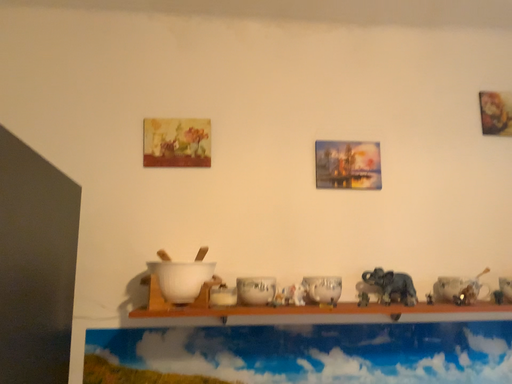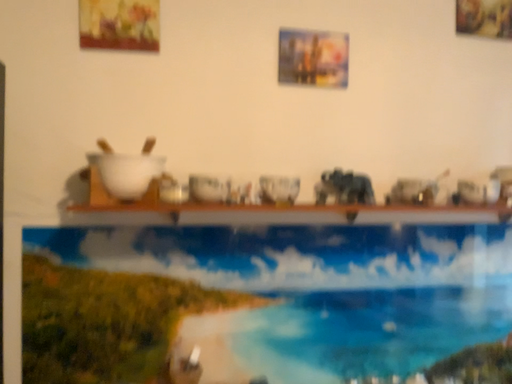
Question: Which way did the camera rotate in the video?

Choices:
 (A) rotated upward
 (B) rotated downward

Answer: (B)